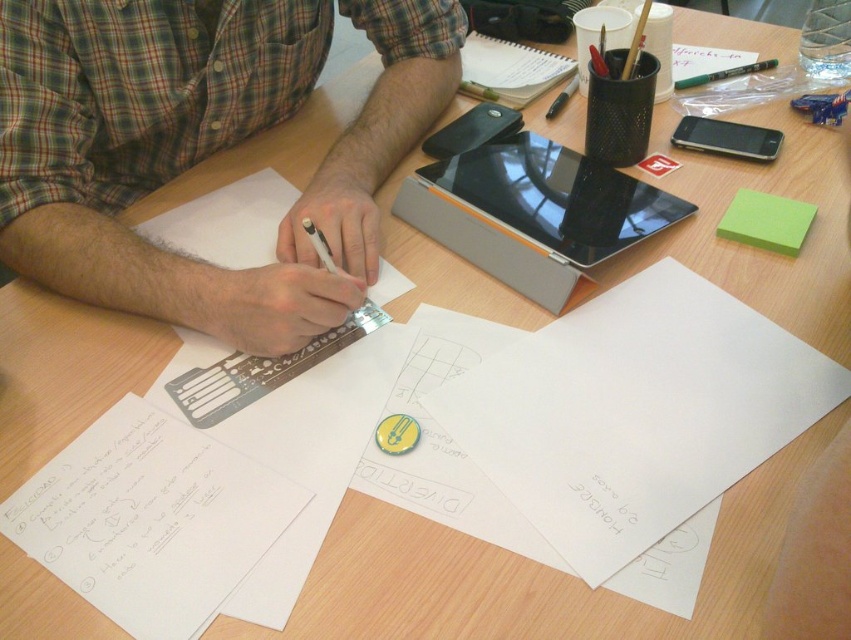
Question: Which of the following is the closest to the observer?

Choices:
 (A) white paper at lower left
 (B) green plaid shirt at upper left
 (C) black glossy tablet at upper right
 (D) white paper at center

Answer: (D)

Question: Observing the image, what is the correct spatial positioning of white paper at center in reference to green plaid shirt at upper left?

Choices:
 (A) left
 (B) right

Answer: (B)

Question: Which object is closer to the camera taking this photo?

Choices:
 (A) green plaid shirt at upper left
 (B) black glossy tablet at upper right
 (C) white paper at center
 (D) white paper at lower left

Answer: (C)

Question: Considering the real-world distances, which object is closest to the white paper at center?

Choices:
 (A) black glossy tablet at upper right
 (B) white paper at lower left

Answer: (B)

Question: Is white paper at center to the left of white paper at lower left from the viewer's perspective?

Choices:
 (A) no
 (B) yes

Answer: (A)

Question: Considering the relative positions of white paper at center and white paper at lower left in the image provided, where is white paper at center located with respect to white paper at lower left?

Choices:
 (A) left
 (B) right

Answer: (B)